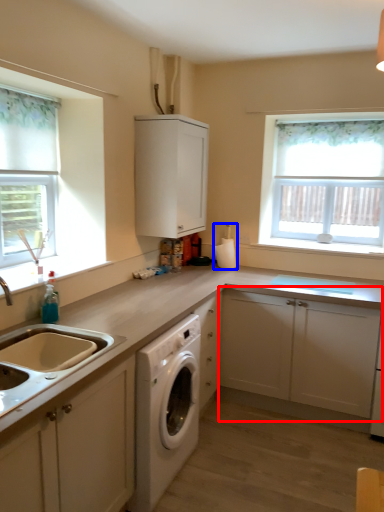
Question: Which object is further to the camera taking this photo, cabinetry (highlighted by a red box) or appliance (highlighted by a blue box)?

Choices:
 (A) cabinetry
 (B) appliance

Answer: (B)